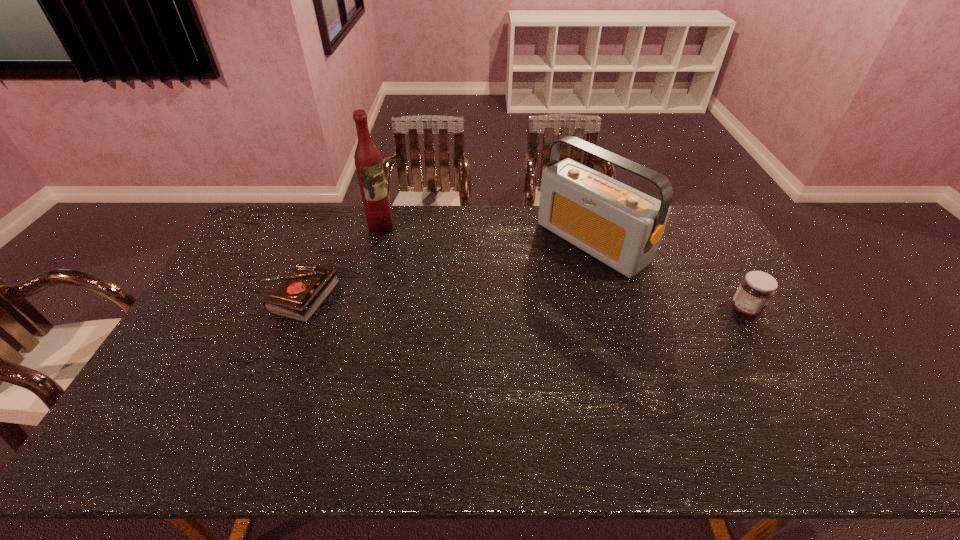
Identify the location of vacant spot on the desktop that is between the diary and the jam and is positioned on the label of the liquor. (457, 301).

Identify the location of vacant spot on the desktop that is between the diary and the rightmost object and is positioned on the front-facing side of the radio receiver. The image size is (960, 540). (501, 303).